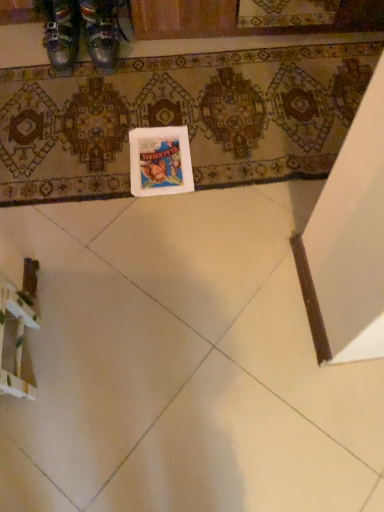
The width and height of the screenshot is (384, 512). I want to click on vacant space in front of metallic leather shoes at upper left, which is counted as the first footwear, starting from the left, so click(54, 86).